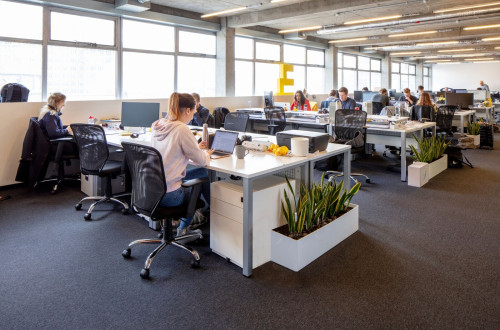
I want to click on desk chairs, so click(x=354, y=124), click(x=275, y=113), click(x=241, y=119), click(x=97, y=141), click(x=39, y=132), click(x=142, y=178), click(x=450, y=112), click(x=424, y=113).